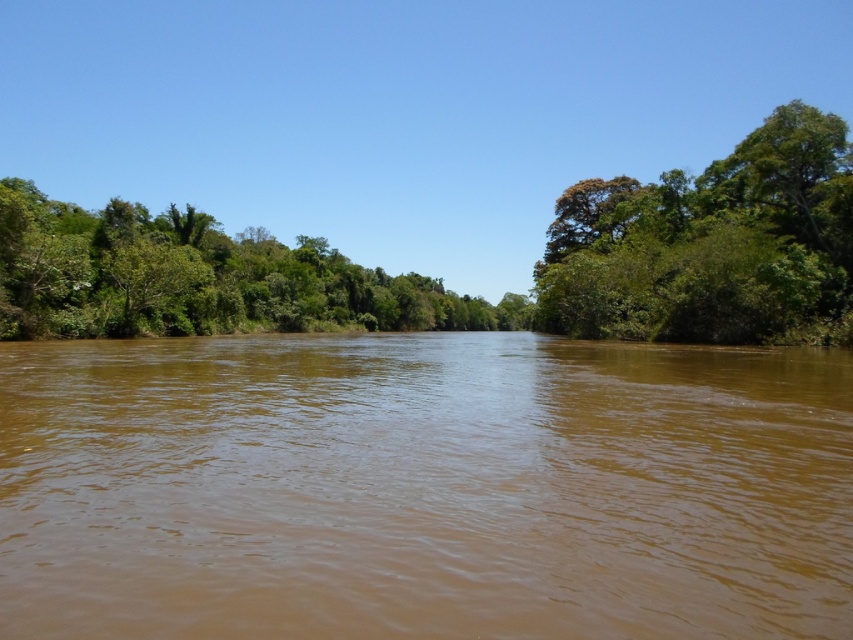
You are a hiker who needs to cross the river. You have a 30 meter long rope. Can you use the rope to cross the river between the brown muddy water at center and the green leafy tree at right?

The distance between the brown muddy water at center and the green leafy tree at right is 36.26 meters. Since the rope is only 30 meters long, it is not long enough to span the distance between them. Therefore, you cannot use the rope to cross the river between those two points.

You are a kayaker planning to navigate the river shown in the image. You see the brown muddy water at center and the green leafy trees at left. Which direction should you paddle to avoid the muddy water?

The brown muddy water at center is to the right of green leafy trees at left, so you should paddle towards the left side where the green leafy trees at left are located to avoid the muddy water.